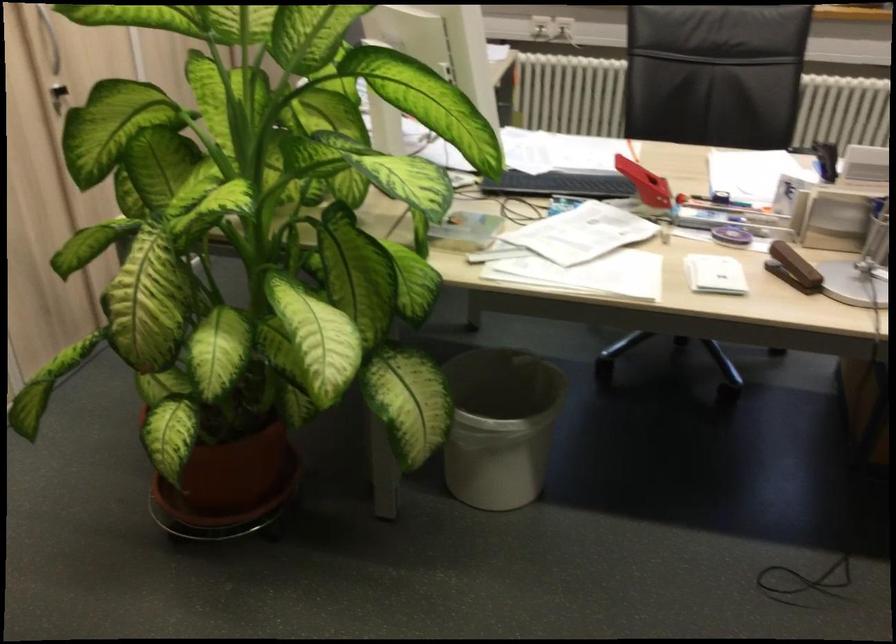
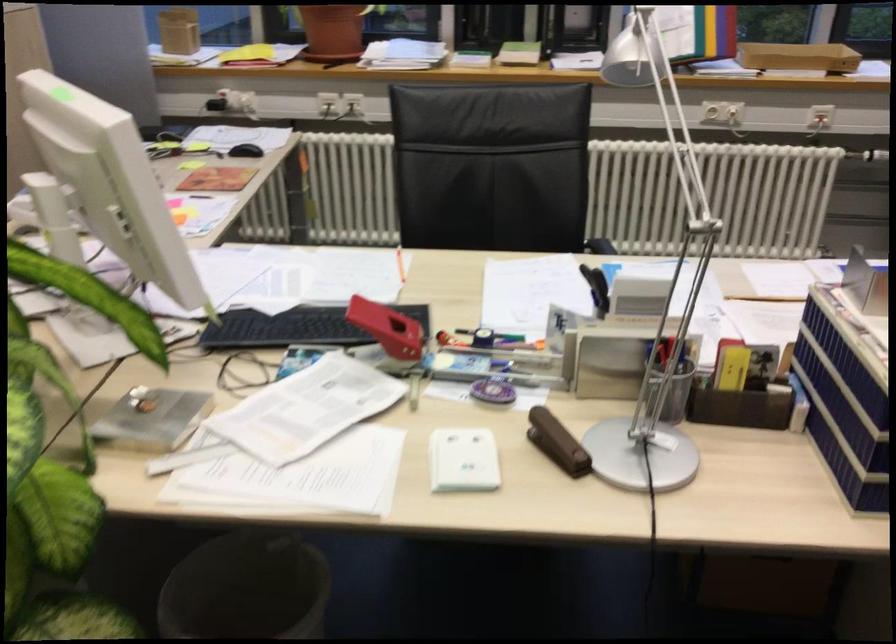
Find the pixel in the second image that matches point (642, 180) in the first image.

(386, 328)